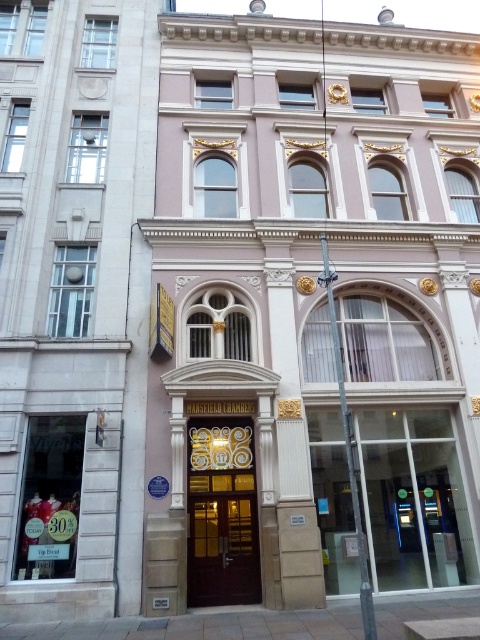
Question: Is matte stone building at center above gold ornate door at center?

Choices:
 (A) no
 (B) yes

Answer: (B)

Question: Among these objects, which one is nearest to the camera?

Choices:
 (A) gold ornate door at center
 (B) matte stone building at center

Answer: (B)

Question: Is matte stone building at center to the left of gold ornate door at center from the viewer's perspective?

Choices:
 (A) no
 (B) yes

Answer: (B)

Question: Which of the following is the closest to the observer?

Choices:
 (A) gold ornate door at center
 (B) matte stone building at center

Answer: (B)

Question: Does matte stone building at center appear on the left side of gold ornate door at center?

Choices:
 (A) no
 (B) yes

Answer: (B)